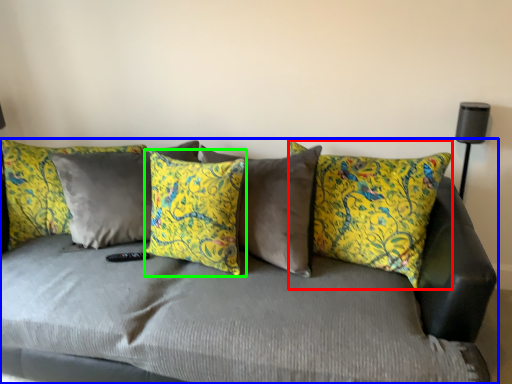
Question: Based on their relative distances, which object is farther from pillow (highlighted by a red box)? Choose from studio couch (highlighted by a blue box) and pillow (highlighted by a green box).

Choices:
 (A) studio couch
 (B) pillow

Answer: (B)